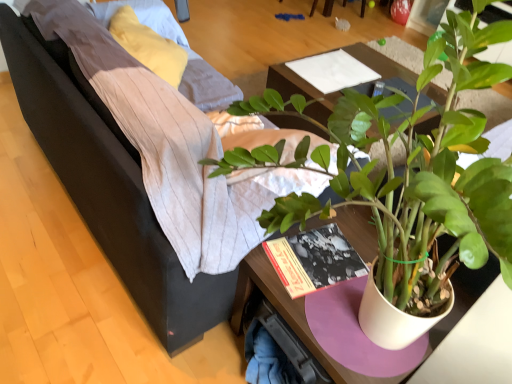
Question: Considering the relative positions of white paper at center and wooden table at center in the image provided, is white paper at center in front of wooden table at center?

Choices:
 (A) yes
 (B) no

Answer: (B)

Question: Is the position of white paper at center more distant than that of wooden table at center?

Choices:
 (A) no
 (B) yes

Answer: (B)

Question: Can you confirm if white paper at center is shorter than wooden table at center?

Choices:
 (A) no
 (B) yes

Answer: (B)

Question: From a real-world perspective, is white paper at center physically below wooden table at center?

Choices:
 (A) yes
 (B) no

Answer: (B)

Question: Considering the relative sizes of white paper at center and wooden table at center in the image provided, is white paper at center taller than wooden table at center?

Choices:
 (A) yes
 (B) no

Answer: (B)

Question: Considering the relative positions of white paper at center and wooden table at center in the image provided, is white paper at center to the right of wooden table at center from the viewer's perspective?

Choices:
 (A) no
 (B) yes

Answer: (A)

Question: Does wooden table at center have a lesser height compared to green matte plant at center?

Choices:
 (A) no
 (B) yes

Answer: (B)

Question: Does wooden table at center appear on the right side of green matte plant at center?

Choices:
 (A) no
 (B) yes

Answer: (B)

Question: Considering the relative sizes of wooden table at center and green matte plant at center in the image provided, is wooden table at center smaller than green matte plant at center?

Choices:
 (A) yes
 (B) no

Answer: (A)

Question: Considering the relative sizes of wooden table at center and green matte plant at center in the image provided, is wooden table at center taller than green matte plant at center?

Choices:
 (A) no
 (B) yes

Answer: (A)

Question: Is wooden table at center next to green matte plant at center?

Choices:
 (A) yes
 (B) no

Answer: (B)

Question: Considering the relative sizes of wooden table at center and green matte plant at center in the image provided, is wooden table at center thinner than green matte plant at center?

Choices:
 (A) no
 (B) yes

Answer: (B)

Question: From the image's perspective, is green matte plant at center located beneath wooden table at center?

Choices:
 (A) no
 (B) yes

Answer: (B)